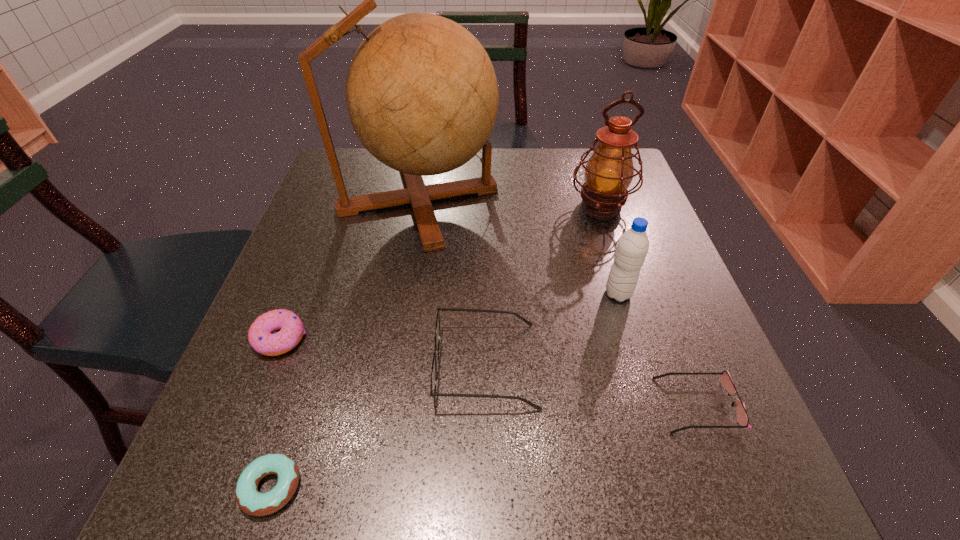
Image resolution: width=960 pixels, height=540 pixels. Find the location of `vacant area situated on the left of the oil lamp`. vacant area situated on the left of the oil lamp is located at coordinates (508, 206).

Image resolution: width=960 pixels, height=540 pixels. Identify the location of free point located 0.320m on the back of the water bottle. (588, 194).

Locate an element on the screen. This screenshot has height=540, width=960. free point located 0.250m on the front-facing side of the spectacles is located at coordinates (291, 365).

I want to click on free spot located 0.130m on the front-facing side of the spectacles, so click(360, 365).

Identify the location of blank space located on the front-facing side of the spectacles. (308, 365).

The width and height of the screenshot is (960, 540). In order to click on free space located on the front of the taller doughnut in this screenshot , I will do `click(228, 470)`.

Locate an element on the screen. The width and height of the screenshot is (960, 540). vacant space situated on the bridge of the sixth tallest object is located at coordinates (524, 405).

The width and height of the screenshot is (960, 540). I want to click on vacant space located on the bridge of the sixth tallest object, so click(556, 405).

This screenshot has width=960, height=540. I want to click on vacant space located 0.240m on the bridge of the sixth tallest object, so click(x=512, y=405).

The width and height of the screenshot is (960, 540). I want to click on free space located on the back of the shortest object, so click(x=307, y=376).